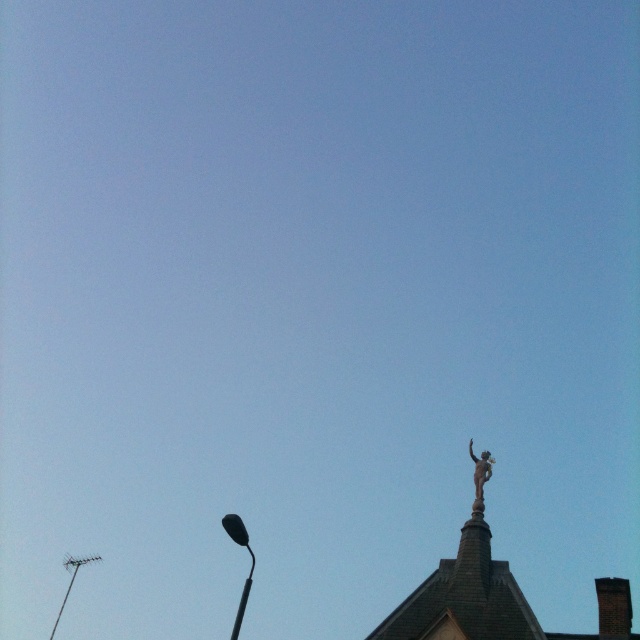
Identify the location of black glossy street light at lower left. (250, 564).

Identify the location of black glossy street light at lower left. (250, 564).

Which of these two, bronze statue at upper right or metallic streetlight at lower left, stands shorter?

With less height is bronze statue at upper right.

Is bronze statue at upper right wider than metallic streetlight at lower left?

Incorrect, bronze statue at upper right's width does not surpass metallic streetlight at lower left's.

Between point (481, 461) and point (56, 620), which one is positioned behind?

The point (56, 620) is more distant.

Find the location of a particular element. This screenshot has height=640, width=640. bronze statue at upper right is located at coordinates (480, 476).

Does black glossy street light at lower left come behind metallic streetlight at lower left?

No, black glossy street light at lower left is in front of metallic streetlight at lower left.

Who is positioned more to the right, black glossy street light at lower left or metallic streetlight at lower left?

black glossy street light at lower left is more to the right.

Image resolution: width=640 pixels, height=640 pixels. Find the location of `black glossy street light at lower left`. black glossy street light at lower left is located at coordinates (250, 564).